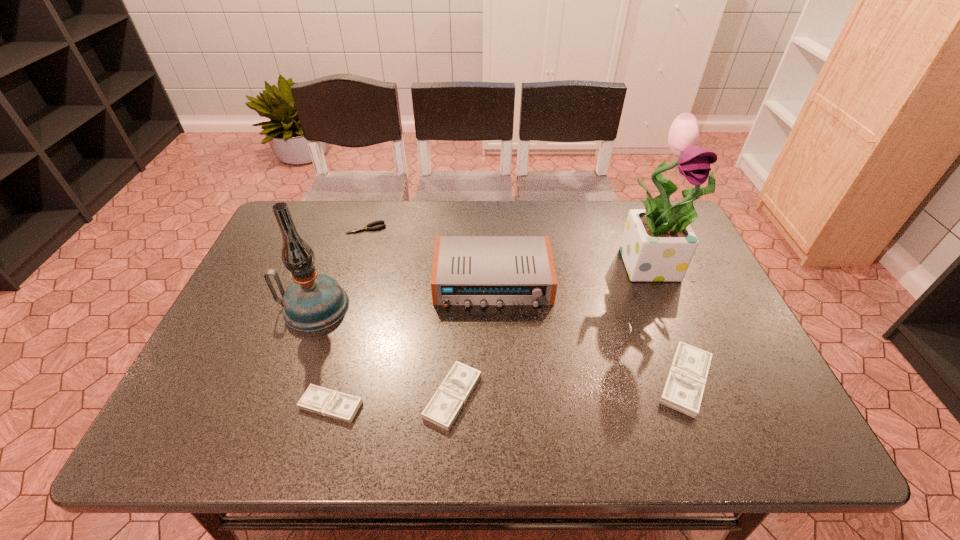
This screenshot has height=540, width=960. What are the coordinates of `the sixth tallest object` in the screenshot? It's located at click(316, 399).

You are a GUI agent. You are given a task and a screenshot of the screen. Output one action in this format:
    pyautogui.click(x=<x>, y=<y>)
    Task: Click on the leftmost money
    
    Given the screenshot: What is the action you would take?
    pyautogui.click(x=316, y=399)

I want to click on the third shortest object, so click(x=442, y=410).

Find the location of `the second shortest money`. the second shortest money is located at coordinates (442, 410).

You are a GUI agent. You are given a task and a screenshot of the screen. Output one action in this format:
    pyautogui.click(x=<x>, y=<y>)
    Task: Click on the rightmost money
    
    Given the screenshot: What is the action you would take?
    pyautogui.click(x=683, y=390)

What are the coordinates of `the farthest object` in the screenshot? It's located at (367, 227).

This screenshot has width=960, height=540. I want to click on pliers, so click(x=367, y=227).

The image size is (960, 540). Identify the location of radio receiver. (467, 270).

At what (x,y) coordinates should I click in order to perform the action: click on flower arrangement. Please return your answer as a coordinate pair (x, y). The image size is (960, 540). Looking at the image, I should click on (x=658, y=244).

You are a GUI agent. You are given a task and a screenshot of the screen. Output one action in this format:
    pyautogui.click(x=<x>, y=<y>)
    Task: Click on the oil lamp
    
    Given the screenshot: What is the action you would take?
    pyautogui.click(x=313, y=302)